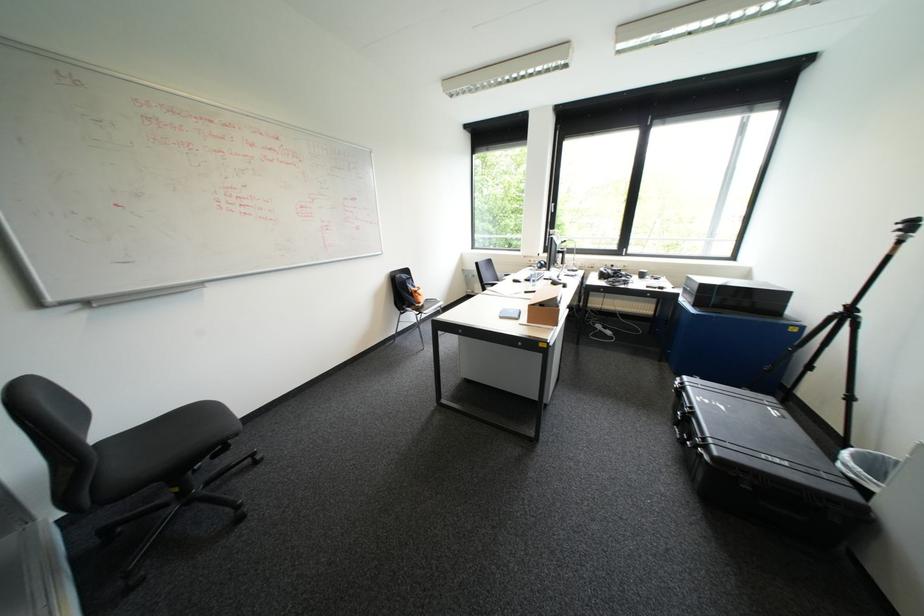
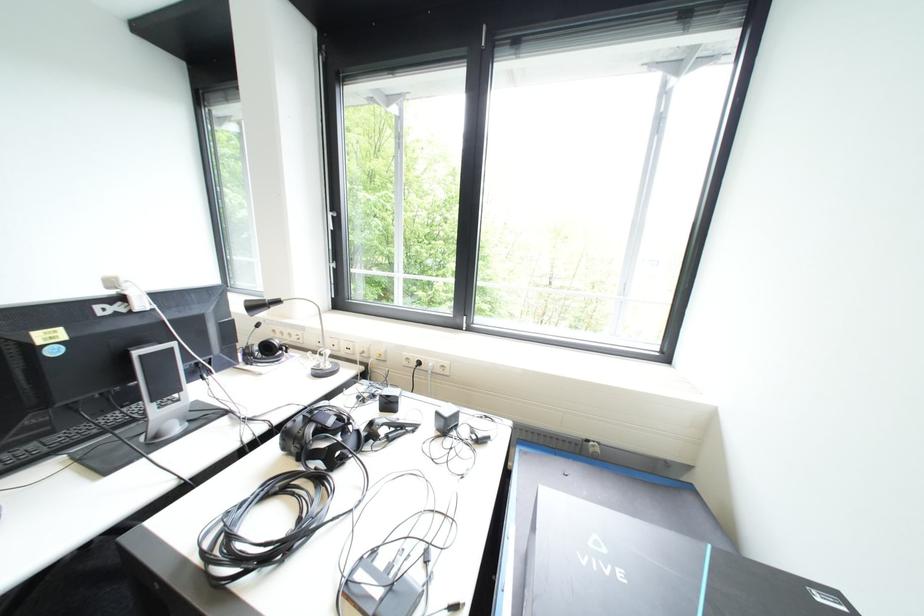
What movement of the cameraman would produce the second image?

The movement direction of the cameraman is right, forward.